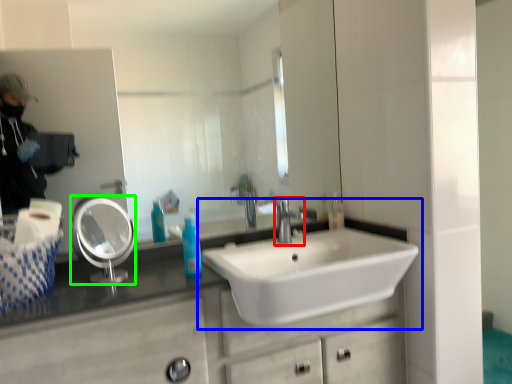
Question: Which is farther away from tap (highlighted by a red box)? sink (highlighted by a blue box) or mirror (highlighted by a green box)?

Choices:
 (A) sink
 (B) mirror

Answer: (B)